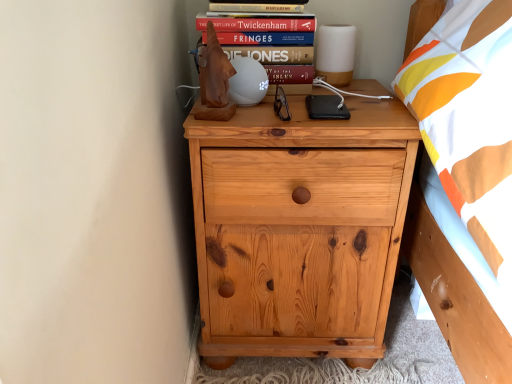
Question: Is hardcover book at upper center further to the viewer compared to natural wood chest of drawers at center?

Choices:
 (A) yes
 (B) no

Answer: (A)

Question: Is natural wood chest of drawers at center located within hardcover book at upper center?

Choices:
 (A) yes
 (B) no

Answer: (B)

Question: From the image's perspective, is hardcover book at upper center beneath natural wood chest of drawers at center?

Choices:
 (A) yes
 (B) no

Answer: (B)

Question: Can you confirm if hardcover book at upper center is wider than natural wood chest of drawers at center?

Choices:
 (A) yes
 (B) no

Answer: (B)

Question: Is hardcover book at upper center bigger than natural wood chest of drawers at center?

Choices:
 (A) yes
 (B) no

Answer: (B)

Question: Is hardcover book at upper center wider or thinner than hardcover book at upper center?

Choices:
 (A) wide
 (B) thin

Answer: (B)

Question: Is point (302, 86) positioned closer to the camera than point (257, 4)?

Choices:
 (A) farther
 (B) closer

Answer: (A)

Question: From the image's perspective, is hardcover book at upper center positioned above or below hardcover book at upper center?

Choices:
 (A) above
 (B) below

Answer: (B)

Question: Is hardcover book at upper center taller or shorter than hardcover book at upper center?

Choices:
 (A) short
 (B) tall

Answer: (B)

Question: Considering the positions of hardcover book at upper center and natural wood chest of drawers at center in the image, is hardcover book at upper center taller or shorter than natural wood chest of drawers at center?

Choices:
 (A) tall
 (B) short

Answer: (B)

Question: Based on their sizes in the image, would you say hardcover book at upper center is bigger or smaller than natural wood chest of drawers at center?

Choices:
 (A) big
 (B) small

Answer: (B)

Question: In the image, is hardcover book at upper center on the left side or the right side of natural wood chest of drawers at center?

Choices:
 (A) right
 (B) left

Answer: (B)

Question: From the image's perspective, is hardcover book at upper center located above or below natural wood chest of drawers at center?

Choices:
 (A) above
 (B) below

Answer: (A)

Question: From the image's perspective, is hardcover book at upper center above or below natural wood chest of drawers at center?

Choices:
 (A) above
 (B) below

Answer: (A)

Question: Is point (301, 29) closer or farther from the camera than point (237, 243)?

Choices:
 (A) closer
 (B) farther

Answer: (B)